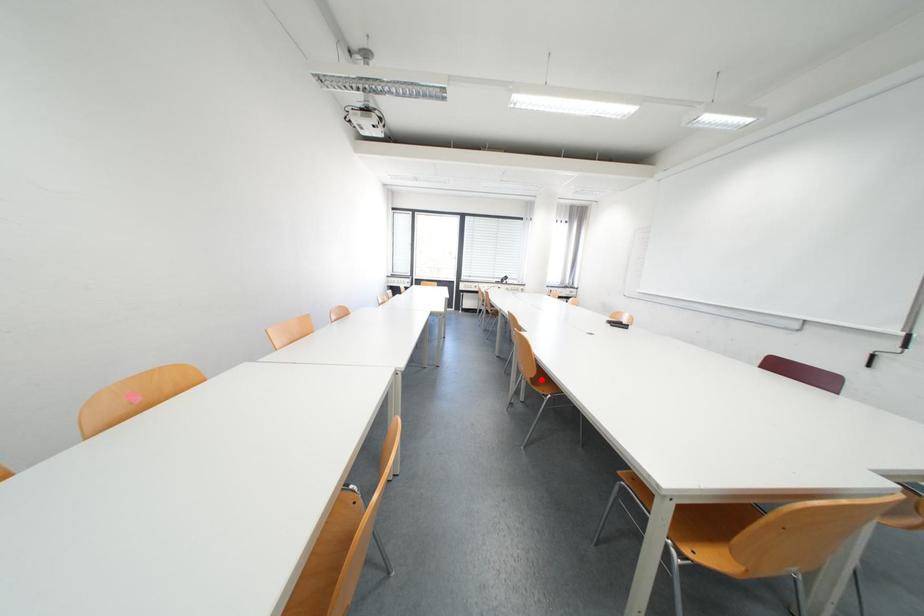
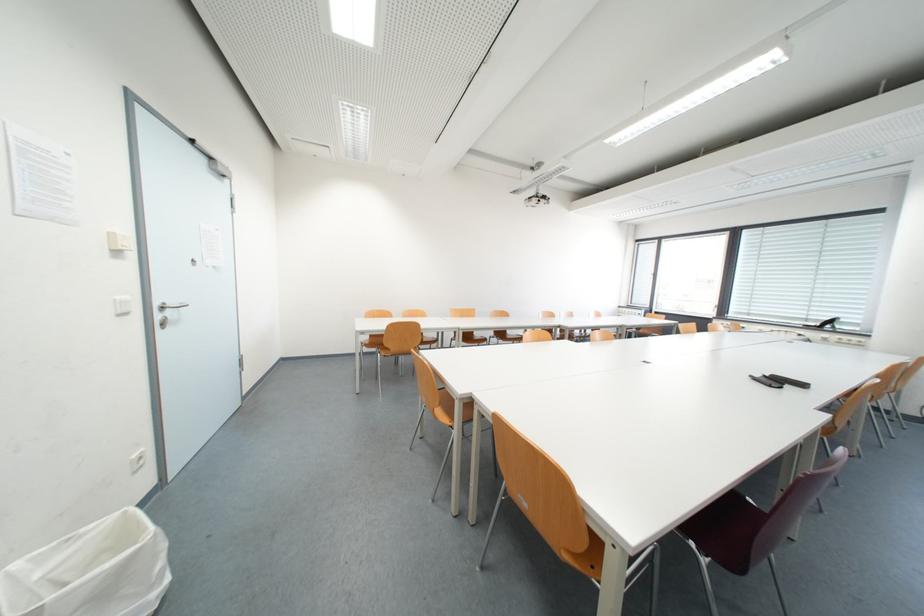
Question: I am providing you with two images of the same scene from different viewpoints. A red point is marked on the first image. Is the red point's position out of view in image 2?

Choices:
 (A) Yes
 (B) No

Answer: (A)